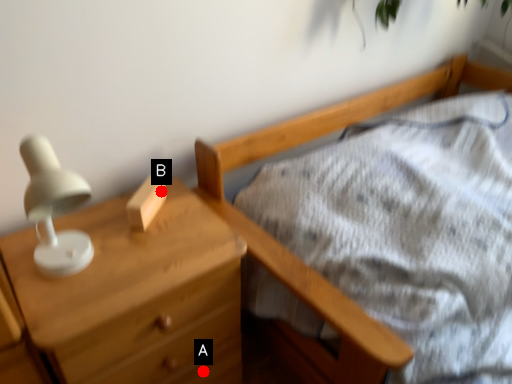
Question: Two points are circled on the image, labeled by A and B beside each circle. Which point is further to the camera?

Choices:
 (A) A is further
 (B) B is further

Answer: (A)